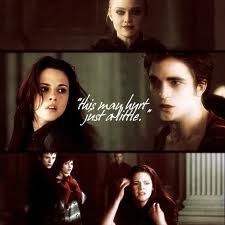
Locate an element on the screen. wall is located at coordinates (80, 175), (166, 162), (8, 170), (55, 27), (106, 79).